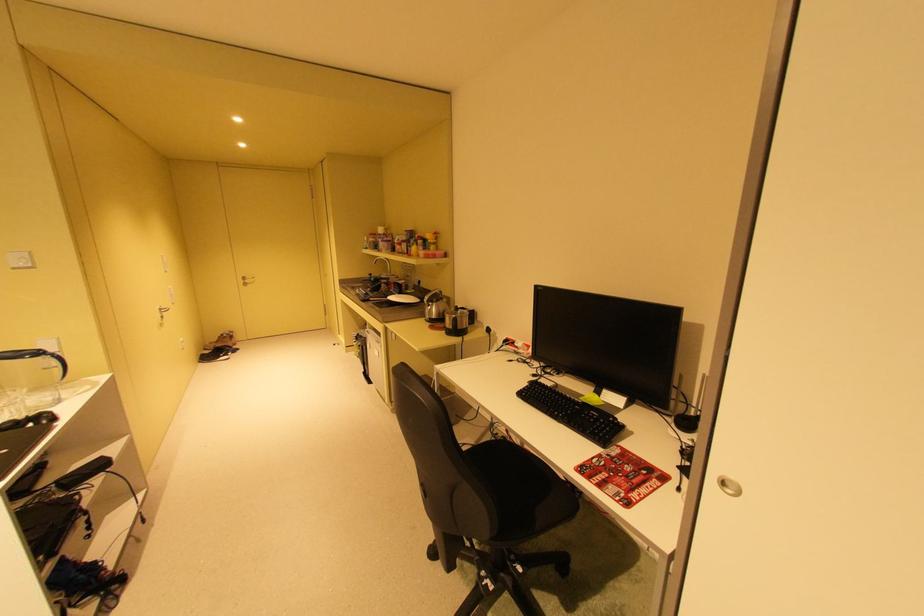
This screenshot has height=616, width=924. What do you see at coordinates (434, 299) in the screenshot? I see `the silver kettle handle` at bounding box center [434, 299].